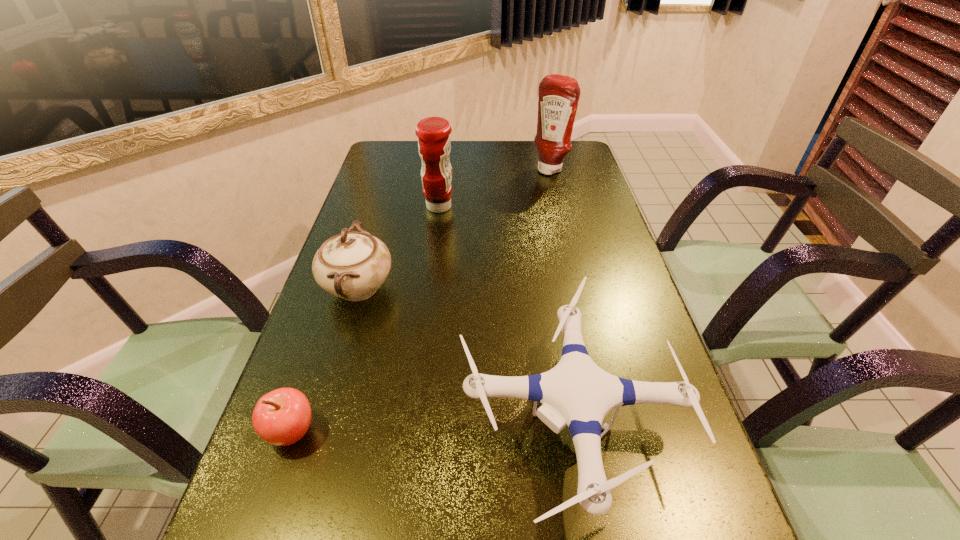
At what (x,y) coordinates should I click in order to perform the action: click on vacant space in between the taller condiment and the third object from right to left. Please return your answer as a coordinate pair (x, y). This screenshot has width=960, height=540. Looking at the image, I should click on (494, 188).

Identify the location of free space between the apple and the taller condiment. (421, 301).

You are a GUI agent. You are given a task and a screenshot of the screen. Output one action in this format:
    pyautogui.click(x=<x>, y=<y>)
    Task: Click on the free space that is in between the chinaware and the left condiment
    Image resolution: width=960 pixels, height=540 pixels.
    Given the screenshot: What is the action you would take?
    pyautogui.click(x=398, y=247)

Locate an element on the screen. object that is the closest to the tallest object is located at coordinates (434, 145).

What are the coordinates of `object that is the closest one to the third tallest object` in the screenshot? It's located at (576, 392).

You are a GUI agent. You are given a task and a screenshot of the screen. Output one action in this format:
    pyautogui.click(x=<x>, y=<y>)
    Task: Click on the vacant space that satisfies the following two spatial constraints: 1. on the back side of the taller condiment; 2. on the left side of the third tallest object
    This screenshot has width=960, height=540.
    Given the screenshot: What is the action you would take?
    pyautogui.click(x=394, y=169)

What are the coordinates of `free space in the image that satisfies the following two spatial constraints: 1. on the back side of the third object from right to left; 2. on the right side of the third tallest object` in the screenshot? It's located at (382, 207).